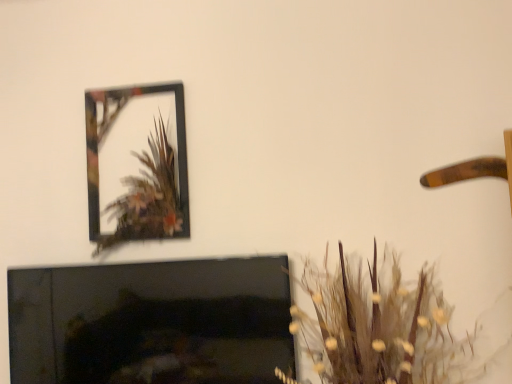
Question: Is metallic frame at upper left at the right side of brown textured plant at lower right?

Choices:
 (A) no
 (B) yes

Answer: (A)

Question: Considering the relative sizes of metallic frame at upper left and brown textured plant at lower right in the image provided, is metallic frame at upper left bigger than brown textured plant at lower right?

Choices:
 (A) yes
 (B) no

Answer: (B)

Question: From the image's perspective, would you say metallic frame at upper left is positioned over brown textured plant at lower right?

Choices:
 (A) yes
 (B) no

Answer: (A)

Question: Is metallic frame at upper left smaller than brown textured plant at lower right?

Choices:
 (A) no
 (B) yes

Answer: (B)

Question: From a real-world perspective, does metallic frame at upper left stand above brown textured plant at lower right?

Choices:
 (A) no
 (B) yes

Answer: (B)

Question: Is metallic frame at upper left further to camera compared to brown textured plant at lower right?

Choices:
 (A) yes
 (B) no

Answer: (A)

Question: Considering the relative positions of metallic frame at upper left and black glossy fireplace at lower left in the image provided, is metallic frame at upper left to the left of black glossy fireplace at lower left from the viewer's perspective?

Choices:
 (A) yes
 (B) no

Answer: (A)

Question: From a real-world perspective, is metallic frame at upper left positioned under black glossy fireplace at lower left based on gravity?

Choices:
 (A) yes
 (B) no

Answer: (B)

Question: Is metallic frame at upper left not inside black glossy fireplace at lower left?

Choices:
 (A) no
 (B) yes

Answer: (B)

Question: Is metallic frame at upper left positioned in front of black glossy fireplace at lower left?

Choices:
 (A) no
 (B) yes

Answer: (A)

Question: Is black glossy fireplace at lower left completely or partially inside metallic frame at upper left?

Choices:
 (A) no
 (B) yes

Answer: (A)

Question: Considering the relative sizes of metallic frame at upper left and black glossy fireplace at lower left in the image provided, is metallic frame at upper left shorter than black glossy fireplace at lower left?

Choices:
 (A) no
 (B) yes

Answer: (A)

Question: Is brown textured plant at lower right positioned far away from metallic frame at upper left?

Choices:
 (A) no
 (B) yes

Answer: (A)